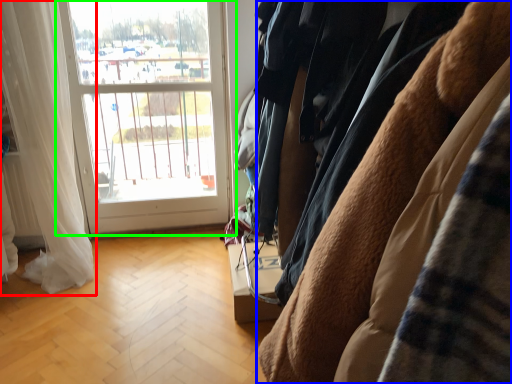
Question: Which object is positioned closest to curtain (highlighted by a red box)? Select from furniture (highlighted by a blue box) and window (highlighted by a green box).

Choices:
 (A) furniture
 (B) window

Answer: (B)